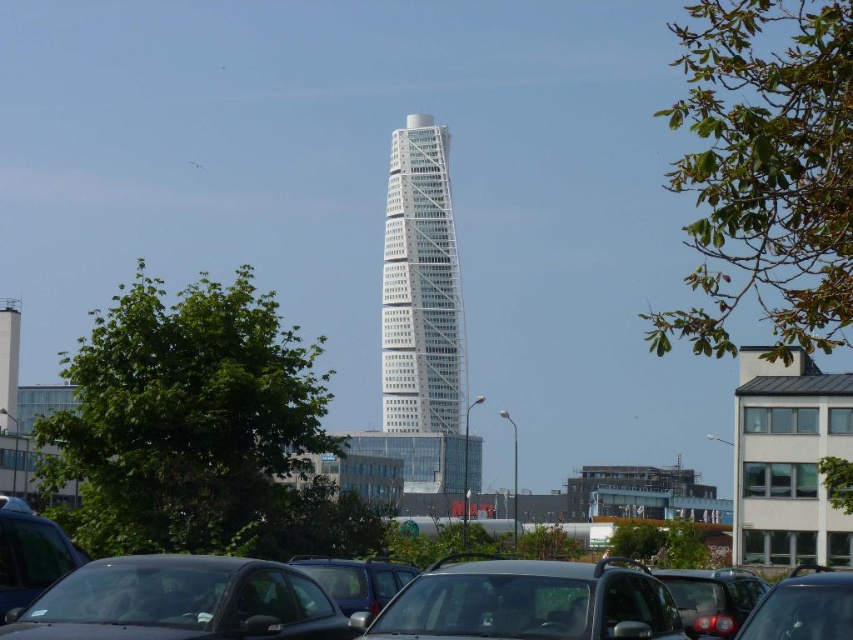
You are a delivery driver who needs to park your matte black car at center in a spot that is to the right of another matte black car at lower left. Based on the scene, can you confirm if the parking lot layout allows this?

Yes, the matte black car at center is already positioned to the right of the matte black car at lower left, so the parking lot layout allows this arrangement.

You are a pedestrian standing in the parking lot and want to walk to the matte black car at center and the matte black car at lower left. Which car should you approach first if you want to reach the one closer to you?

You should approach the matte black car at center first because it is closer to you than the matte black car at lower left.